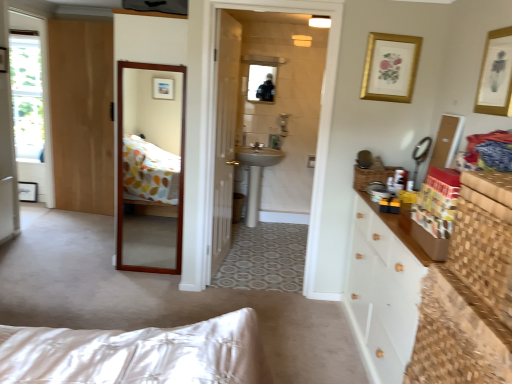
In order to click on vacant space behind translucent glass door at center, the second door in the left-to-right sequence in this screenshot , I will do `click(245, 255)`.